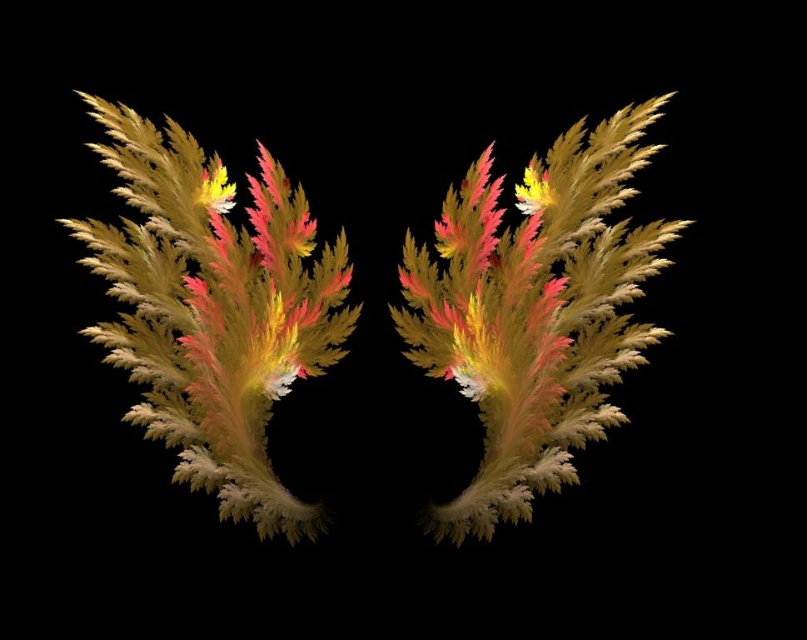
You are an artist analyzing the composition of the image. You notice the shiny golden leaf at center and the velvety gold and pink flower at left. Based on their positions, which object is closer to the right edge of the image?

The shiny golden leaf at center is closer to the right edge of the image because it is positioned to the right of the velvety gold and pink flower at left.

You are an artist analyzing the central elements of the image. You notice the shiny golden leaf at center and the multicolored frond at center. Which central element is taller?

The multicolored frond at center is taller than the shiny golden leaf at center.